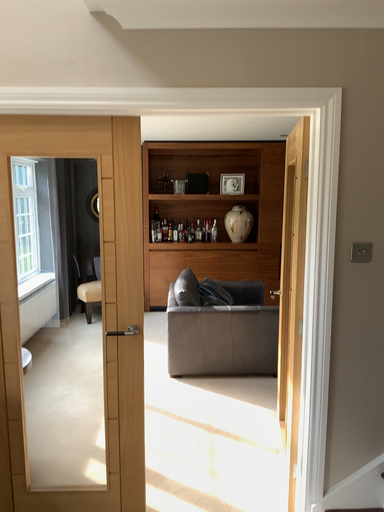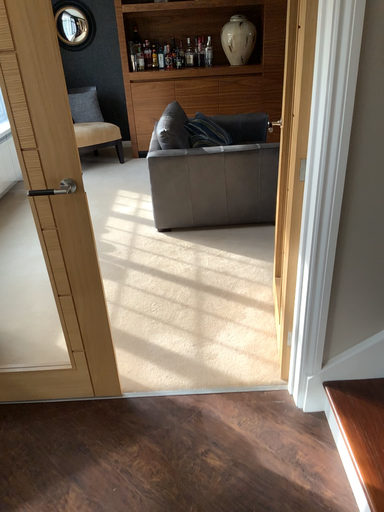
Question: How did the camera likely rotate when shooting the video?

Choices:
 (A) rotated downward
 (B) rotated upward

Answer: (A)